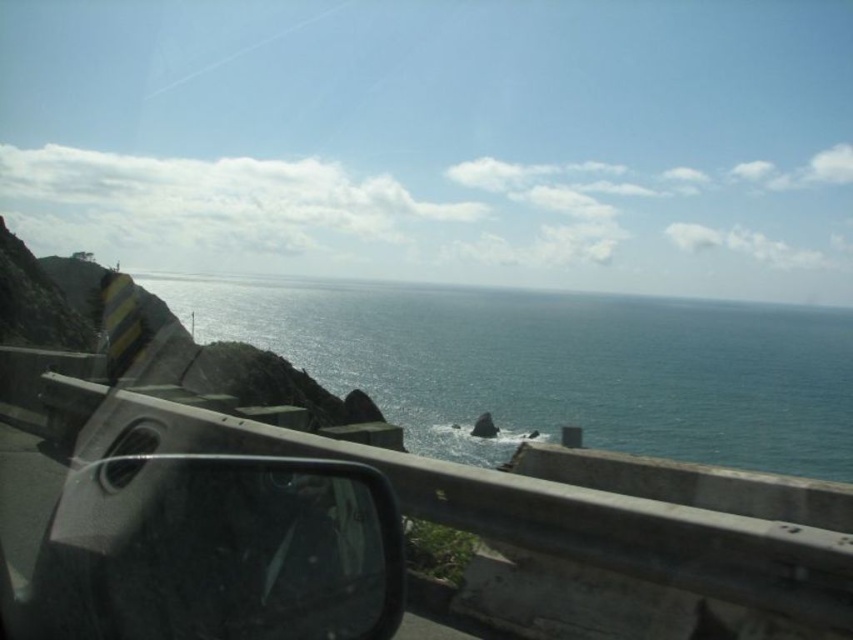
You are driving a car with a 5 meter long trailer attached to it. You see the blue water at center and the glossy plastic view mirror at lower left. Can you safely back up your trailer into the space between them without hitting either object?

The blue water at center and glossy plastic view mirror at lower left are 81.78 meters apart. Since the trailer is only 5 meters long, there is plenty of space between them to safely back up without hitting either object.

You are driving along a coastal road and notice the blue water at center and the glossy plastic view mirror at lower left. Which object appears taller in the scene?

The blue water at center appears taller than the glossy plastic view mirror at lower left because the description states that the blue water at center has a greater height compared to the glossy plastic view mirror at lower left.